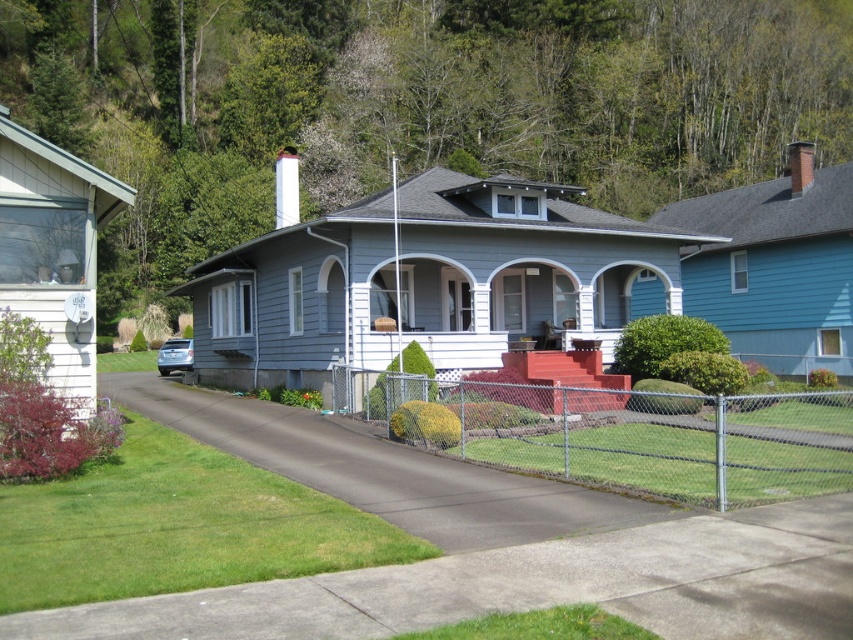
Is metallic chain-link fence at center positioned behind satin silver sedan at center?

No, metallic chain-link fence at center is in front of satin silver sedan at center.

Can you confirm if metallic chain-link fence at center is shorter than satin silver sedan at center?

Incorrect, metallic chain-link fence at center's height does not fall short of satin silver sedan at center's.

What do you see at coordinates (630, 435) in the screenshot?
I see `metallic chain-link fence at center` at bounding box center [630, 435].

At what (x,y) coordinates should I click in order to perform the action: click on metallic chain-link fence at center. Please return your answer as a coordinate pair (x, y). This screenshot has width=853, height=640. Looking at the image, I should click on (630, 435).